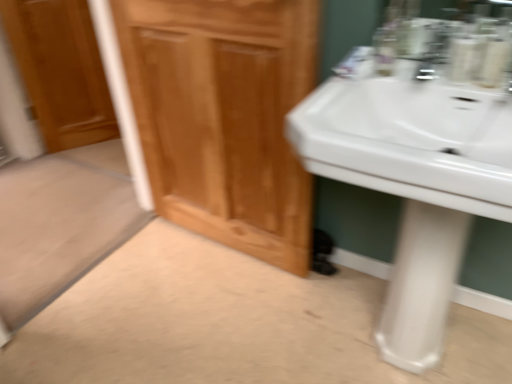
The width and height of the screenshot is (512, 384). What are the coordinates of `white glossy sink at right` in the screenshot? It's located at (409, 137).

Image resolution: width=512 pixels, height=384 pixels. What do you see at coordinates (409, 137) in the screenshot?
I see `white glossy sink at right` at bounding box center [409, 137].

The image size is (512, 384). Describe the element at coordinates (421, 285) in the screenshot. I see `white glossy pedestal at lower right` at that location.

Measure the distance between wooden cabinet at center and camera.

wooden cabinet at center is 1.06 meters away from camera.

The image size is (512, 384). In order to click on white glossy sink at right in this screenshot , I will do `click(409, 137)`.

Does wooden door at left have a smaller size compared to white glossy sink at right?

Correct, wooden door at left occupies less space than white glossy sink at right.

Is wooden door at left located outside white glossy sink at right?

Yes, wooden door at left is outside of white glossy sink at right.

Considering the positions of objects wooden door at left and white glossy sink at right in the image provided, who is more to the left, wooden door at left or white glossy sink at right?

From the viewer's perspective, wooden door at left appears more on the left side.

Who is taller, wooden door at left or white glossy sink at right?

With more height is wooden door at left.

From the image's perspective, is wooden door at left positioned above or below wooden cabinet at center?

wooden door at left is above wooden cabinet at center.

Does wooden door at left have a lesser width compared to wooden cabinet at center?

Correct, the width of wooden door at left is less than that of wooden cabinet at center.

Would you consider wooden door at left to be distant from wooden cabinet at center?

Absolutely, wooden door at left is distant from wooden cabinet at center.

Could you tell me if white glossy sink at right is facing wooden cabinet at center?

No, white glossy sink at right is not turned towards wooden cabinet at center.

Does white glossy sink at right lie in front of wooden cabinet at center?

Yes, it is.

Does white glossy sink at right appear on the right side of wooden cabinet at center?

Yes, white glossy sink at right is to the right of wooden cabinet at center.

From the image's perspective, is white glossy sink at right on top of wooden cabinet at center?

Actually, white glossy sink at right appears below wooden cabinet at center in the image.

From a real-world perspective, is white glossy pedestal at lower right positioned above or below white glossy sink at right?

white glossy pedestal at lower right is situated lower than white glossy sink at right in the real world.

Consider the image. Is white glossy pedestal at lower right not inside white glossy sink at right?

Yes, white glossy pedestal at lower right is outside of white glossy sink at right.

Is white glossy pedestal at lower right bigger or smaller than white glossy sink at right?

Clearly, white glossy pedestal at lower right is smaller in size than white glossy sink at right.

This screenshot has height=384, width=512. Find the location of `pillar that appears below the white glossy sink at right (from a real-world perspective)`. pillar that appears below the white glossy sink at right (from a real-world perspective) is located at coordinates (421, 285).

From the image's perspective, relative to white glossy pedestal at lower right, is wooden door at left above or below?

wooden door at left is above white glossy pedestal at lower right.

Looking at their sizes, would you say wooden door at left is wider or thinner than white glossy pedestal at lower right?

Considering their sizes, wooden door at left looks slimmer than white glossy pedestal at lower right.

From a real-world perspective, which is physically above, wooden door at left or white glossy pedestal at lower right?

wooden door at left.

Which point is more forward, (272, 153) or (67, 11)?

The point (272, 153) is closer.

Who is bigger, wooden cabinet at center or wooden door at left?

Bigger between the two is wooden cabinet at center.

Is wooden cabinet at center in front of or behind wooden door at left in the image?

wooden cabinet at center is in front of wooden door at left.

The height and width of the screenshot is (384, 512). Identify the location of bathroom cabinet located below the wooden door at left (from the image's perspective). point(224,117).

Which of these two, white glossy sink at right or white glossy pedestal at lower right, is thinner?

With smaller width is white glossy pedestal at lower right.

Between white glossy sink at right and white glossy pedestal at lower right, which one has more height?

white glossy pedestal at lower right.

Where is `sink that is above the white glossy pedestal at lower right (from the image's perspective)`? The width and height of the screenshot is (512, 384). sink that is above the white glossy pedestal at lower right (from the image's perspective) is located at coordinates (409, 137).

Find the location of a particular element. The width and height of the screenshot is (512, 384). sink that is in front of the wooden door at left is located at coordinates (x=409, y=137).

Where is `door on the left side of wooden cabinet at center`? This screenshot has width=512, height=384. door on the left side of wooden cabinet at center is located at coordinates click(61, 70).

Based on their spatial positions, is wooden door at left or white glossy pedestal at lower right further from white glossy sink at right?

wooden door at left is further to white glossy sink at right.

Looking at the image, which one is located closer to wooden door at left, white glossy pedestal at lower right or wooden cabinet at center?

Based on the image, wooden cabinet at center appears to be nearer to wooden door at left.

When comparing their distances from white glossy sink at right, does wooden cabinet at center or white glossy pedestal at lower right seem closer?

Among the two, white glossy pedestal at lower right is located nearer to white glossy sink at right.

Based on their spatial positions, is wooden door at left or wooden cabinet at center further from white glossy sink at right?

wooden door at left is positioned further to the anchor white glossy sink at right.

When comparing their distances from white glossy pedestal at lower right, does white glossy sink at right or wooden door at left seem further?

wooden door at left is further to white glossy pedestal at lower right.

From the picture: Based on their spatial positions, is white glossy sink at right or wooden cabinet at center further from white glossy pedestal at lower right?

The object further to white glossy pedestal at lower right is wooden cabinet at center.

Estimate the real-world distances between objects in this image. Which object is further from white glossy pedestal at lower right, wooden cabinet at center or white glossy sink at right?

Based on the image, wooden cabinet at center appears to be further to white glossy pedestal at lower right.

Estimate the real-world distances between objects in this image. Which object is closer to wooden cabinet at center, white glossy sink at right or white glossy pedestal at lower right?

Among the two, white glossy sink at right is located nearer to wooden cabinet at center.

Find the location of a particular element. bathroom cabinet between wooden door at left and white glossy pedestal at lower right in the horizontal direction is located at coordinates (224, 117).

Image resolution: width=512 pixels, height=384 pixels. In order to click on bathroom cabinet between wooden door at left and white glossy sink at right from left to right in this screenshot , I will do `click(224, 117)`.

The width and height of the screenshot is (512, 384). In order to click on sink situated between wooden door at left and white glossy pedestal at lower right from left to right in this screenshot , I will do `click(409, 137)`.

Find the location of a particular element. sink between wooden cabinet at center and white glossy pedestal at lower right is located at coordinates (409, 137).